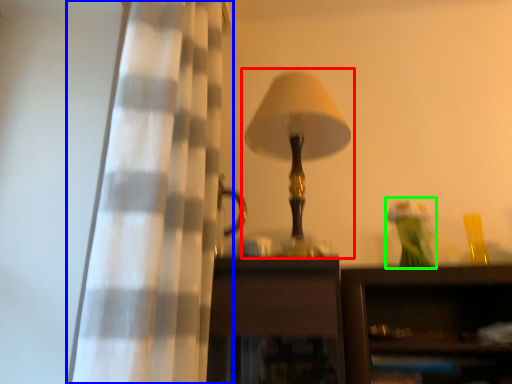
Question: Considering the real-world distances, which object is closest to lamp (highlighted by a red box)? curtain (highlighted by a blue box) or toy (highlighted by a green box).

Choices:
 (A) curtain
 (B) toy

Answer: (A)